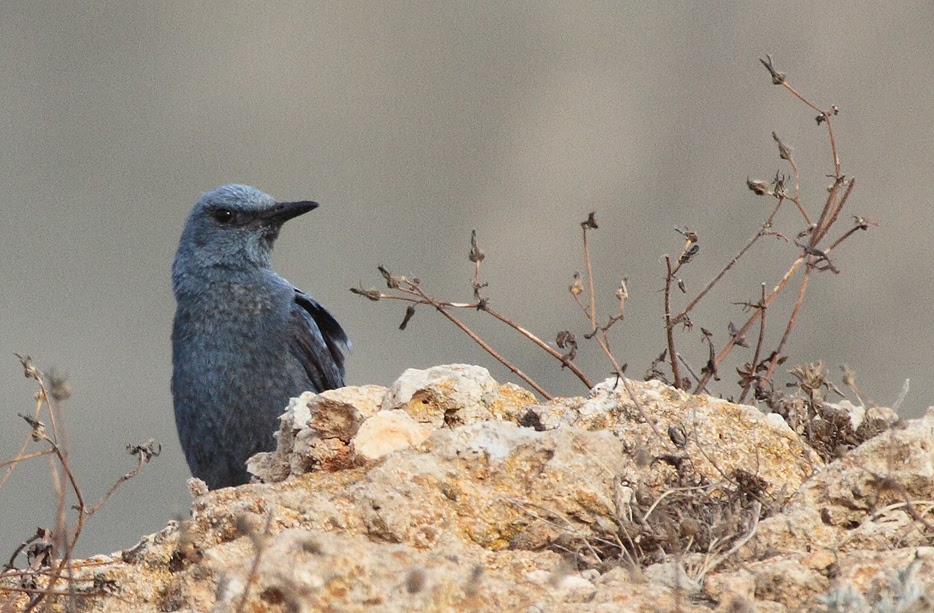
Image resolution: width=934 pixels, height=613 pixels. Find the location of `brown plant`. brown plant is located at coordinates point(808,379).